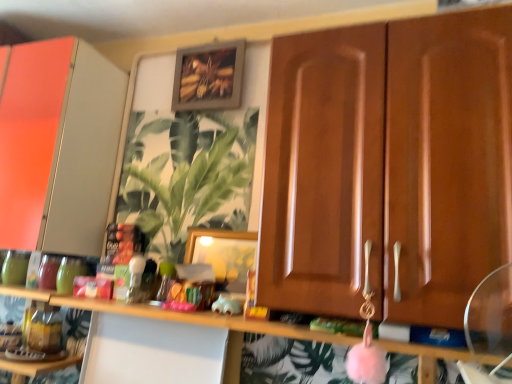
Question: Considering the relative sizes of pink fuzzy ball at center and matte white cabinet at left, the 1th cabinetry positioned from the left, in the image provided, is pink fuzzy ball at center thinner than matte white cabinet at left, the 1th cabinetry positioned from the left,?

Choices:
 (A) no
 (B) yes

Answer: (B)

Question: Could you tell me if pink fuzzy ball at center is facing matte white cabinet at left, the 2th cabinetry when ordered from right to left?

Choices:
 (A) yes
 (B) no

Answer: (B)

Question: Is pink fuzzy ball at center next to matte white cabinet at left, which ranks as the 1th cabinetry in back-to-front order?

Choices:
 (A) yes
 (B) no

Answer: (B)

Question: From the image's perspective, does pink fuzzy ball at center appear higher than matte white cabinet at left, the 1th cabinetry positioned from the left?

Choices:
 (A) yes
 (B) no

Answer: (B)

Question: Does pink fuzzy ball at center have a larger size compared to matte white cabinet at left, the 1th cabinetry positioned from the left?

Choices:
 (A) yes
 (B) no

Answer: (B)

Question: Is pink fuzzy ball at center not near matte white cabinet at left, which ranks as the 1th cabinetry in back-to-front order?

Choices:
 (A) yes
 (B) no

Answer: (B)

Question: Is wooden picture frame at center, positioned as the first picture frame in bottom-to-top order, not inside green leafy plant at center?

Choices:
 (A) yes
 (B) no

Answer: (A)

Question: Considering the relative positions of wooden picture frame at center, acting as the 1th picture frame starting from the front, and green leafy plant at center in the image provided, is wooden picture frame at center, acting as the 1th picture frame starting from the front, to the left of green leafy plant at center from the viewer's perspective?

Choices:
 (A) yes
 (B) no

Answer: (B)

Question: Is green leafy plant at center completely or partially inside wooden picture frame at center, acting as the 1th picture frame starting from the front?

Choices:
 (A) yes
 (B) no

Answer: (B)

Question: Does wooden picture frame at center, the 2th picture frame when ordered from top to bottom, lie in front of green leafy plant at center?

Choices:
 (A) yes
 (B) no

Answer: (A)

Question: Is wooden picture frame at center, the 2th picture frame when ordered from top to bottom, positioned behind green leafy plant at center?

Choices:
 (A) no
 (B) yes

Answer: (A)

Question: Is wooden picture frame at center, acting as the 1th picture frame starting from the front, not near green leafy plant at center?

Choices:
 (A) yes
 (B) no

Answer: (B)

Question: Is wooden cabinet doors at center, the first cabinetry viewed from the right, positioned before wooden frame at upper center, which is the 1th picture frame in back-to-front order?

Choices:
 (A) no
 (B) yes

Answer: (B)